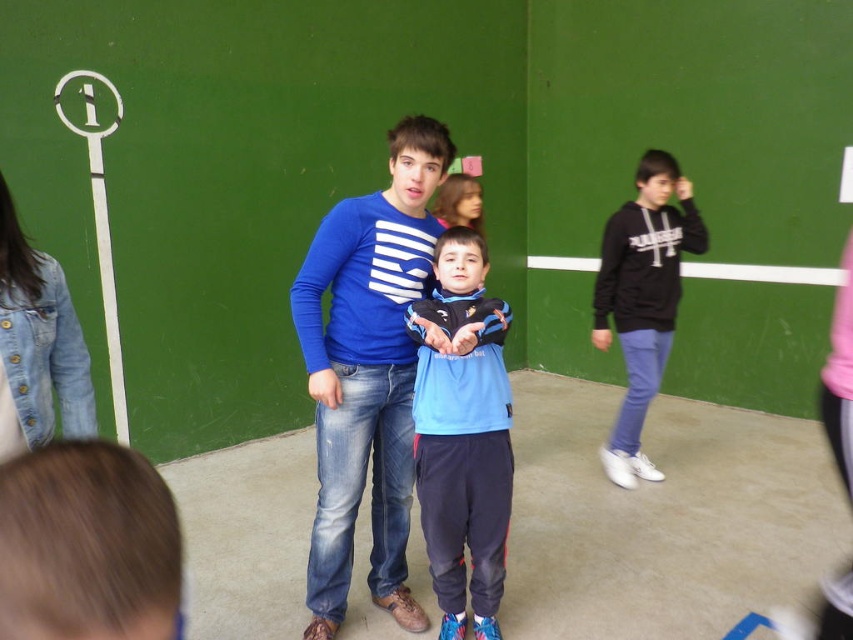
Question: Which point is closer to the camera?

Choices:
 (A) blue fleece jacket at center
 (B) black matte hoodie at right

Answer: (A)

Question: Does blue striped long-sleeve shirt at center appear over blue fleece jacket at center?

Choices:
 (A) no
 (B) yes

Answer: (B)

Question: Is blue striped long-sleeve shirt at center positioned at the back of black matte hoodie at right?

Choices:
 (A) yes
 (B) no

Answer: (B)

Question: Which point is closer to the camera?

Choices:
 (A) black matte hoodie at right
 (B) blue fleece jacket at center
 (C) blue striped long-sleeve shirt at center

Answer: (B)

Question: Does blue fleece jacket at center have a larger size compared to black matte hoodie at right?

Choices:
 (A) yes
 (B) no

Answer: (B)

Question: Which object is the farthest from the blue striped long-sleeve shirt at center?

Choices:
 (A) black matte hoodie at right
 (B) blue fleece jacket at center

Answer: (A)